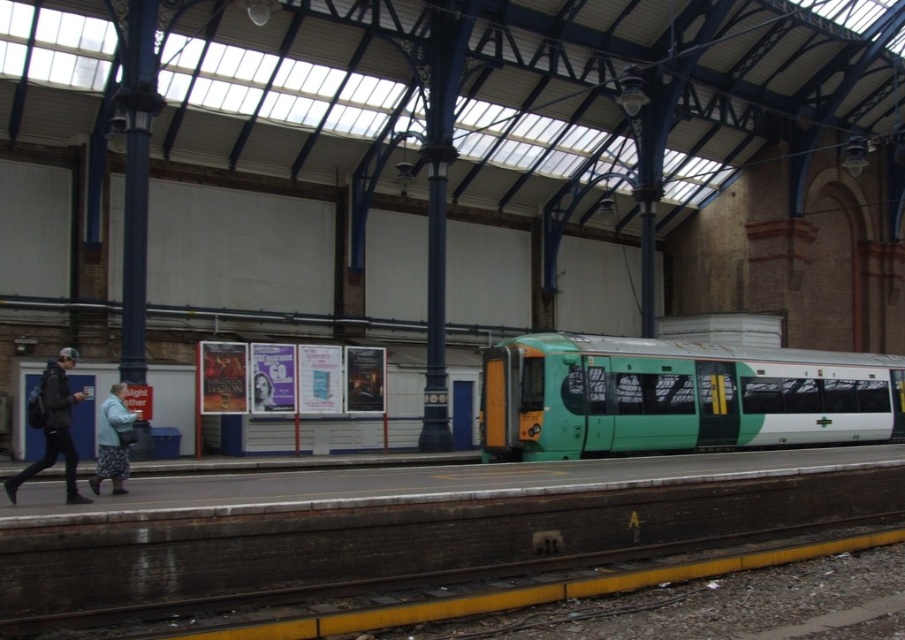
Does green matte train at center appear on the right side of fluffy gray coat at lower left?

Yes, green matte train at center is to the right of fluffy gray coat at lower left.

Can you confirm if green matte train at center is wider than fluffy gray coat at lower left?

Correct, the width of green matte train at center exceeds that of fluffy gray coat at lower left.

Is point (680, 362) positioned before point (120, 465)?

No, it is not.

This screenshot has height=640, width=905. Find the location of `green matte train at center`. green matte train at center is located at coordinates (677, 396).

Does dark blue jacket at left have a lesser width compared to fluffy gray coat at lower left?

No, dark blue jacket at left is not thinner than fluffy gray coat at lower left.

Does point (63, 356) come behind point (122, 422)?

No, (63, 356) is in front of (122, 422).

The height and width of the screenshot is (640, 905). I want to click on dark blue jacket at left, so click(x=53, y=426).

Between green matte train at center and dark blue jacket at left, which one has more height?

green matte train at center

Between point (875, 372) and point (72, 476), which one is positioned in front?

Point (72, 476) is more forward.

This screenshot has height=640, width=905. In order to click on green matte train at center in this screenshot , I will do `click(677, 396)`.

You are a GUI agent. You are given a task and a screenshot of the screen. Output one action in this format:
    pyautogui.click(x=<x>, y=<y>)
    Task: Click on the green matte train at center
    The image size is (905, 640).
    Given the screenshot: What is the action you would take?
    [x=677, y=396]